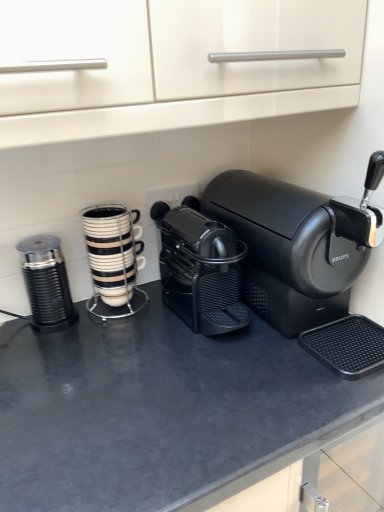
Question: Would you say black matte coffee maker at center, which is the 2th coffee maker in left-to-right order, is part of metallic ribbed grinder at left, marked as the second kitchen appliance in a right-to-left arrangement,'s contents?

Choices:
 (A) yes
 (B) no

Answer: (B)

Question: From a real-world perspective, is metallic ribbed grinder at left, which is the first kitchen appliance from left to right, located higher than black matte coffee maker at center, which is the 1th coffee maker from right to left?

Choices:
 (A) no
 (B) yes

Answer: (A)

Question: Considering the relative positions of metallic ribbed grinder at left, marked as the second kitchen appliance in a right-to-left arrangement, and black matte coffee maker at center, which is the 2th coffee maker in left-to-right order, in the image provided, is metallic ribbed grinder at left, marked as the second kitchen appliance in a right-to-left arrangement, behind black matte coffee maker at center, which is the 2th coffee maker in left-to-right order,?

Choices:
 (A) no
 (B) yes

Answer: (B)

Question: Considering the relative sizes of metallic ribbed grinder at left, marked as the second kitchen appliance in a right-to-left arrangement, and black matte coffee maker at center, which is the 1th coffee maker from right to left, in the image provided, is metallic ribbed grinder at left, marked as the second kitchen appliance in a right-to-left arrangement, wider than black matte coffee maker at center, which is the 1th coffee maker from right to left,?

Choices:
 (A) no
 (B) yes

Answer: (A)

Question: Is metallic ribbed grinder at left, which is the first kitchen appliance from left to right, oriented towards black matte coffee maker at center, which is the 1th coffee maker from right to left?

Choices:
 (A) yes
 (B) no

Answer: (B)

Question: Can you confirm if metallic ribbed grinder at left, which is the first kitchen appliance from left to right, is smaller than black matte coffee maker at center, which is the 1th coffee maker from right to left?

Choices:
 (A) yes
 (B) no

Answer: (A)

Question: Is black matte counter top at center surrounded by metallic ribbed grinder at left, marked as the second kitchen appliance in a right-to-left arrangement?

Choices:
 (A) yes
 (B) no

Answer: (B)

Question: Is metallic ribbed grinder at left, which is the first kitchen appliance from left to right, taller than black matte counter top at center?

Choices:
 (A) no
 (B) yes

Answer: (A)

Question: From a real-world perspective, is metallic ribbed grinder at left, which is the first kitchen appliance from left to right, over black matte counter top at center?

Choices:
 (A) yes
 (B) no

Answer: (A)

Question: Is metallic ribbed grinder at left, marked as the second kitchen appliance in a right-to-left arrangement, facing towards black matte counter top at center?

Choices:
 (A) no
 (B) yes

Answer: (A)

Question: From the image's perspective, does metallic ribbed grinder at left, which is the first kitchen appliance from left to right, appear lower than black matte counter top at center?

Choices:
 (A) no
 (B) yes

Answer: (A)

Question: Is metallic ribbed grinder at left, marked as the second kitchen appliance in a right-to-left arrangement, at the left side of black matte counter top at center?

Choices:
 (A) yes
 (B) no

Answer: (A)

Question: From the image's perspective, is black matte counter top at center under white glossy cup stack at center, the first kitchen appliance positioned from the right?

Choices:
 (A) yes
 (B) no

Answer: (A)